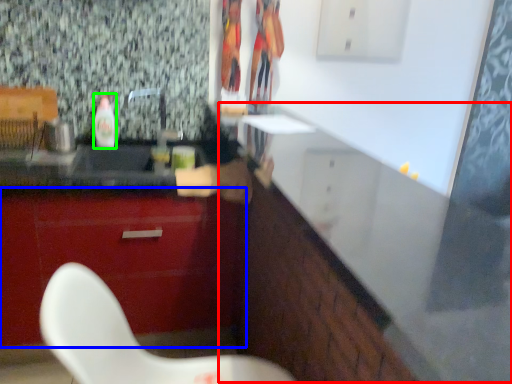
Question: Considering the real-world distances, which object is closest to counter (highlighted by a red box)? cabinetry (highlighted by a blue box) or bottle (highlighted by a green box).

Choices:
 (A) cabinetry
 (B) bottle

Answer: (A)